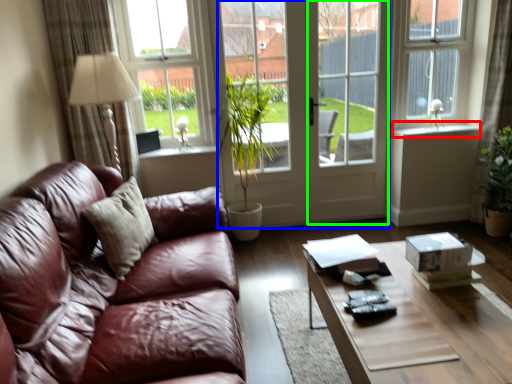
Question: Estimate the real-world distances between objects in this image. Which object is closer to window sill (highlighted by a red box), screen door (highlighted by a blue box) or screen door (highlighted by a green box)?

Choices:
 (A) screen door
 (B) screen door

Answer: (B)